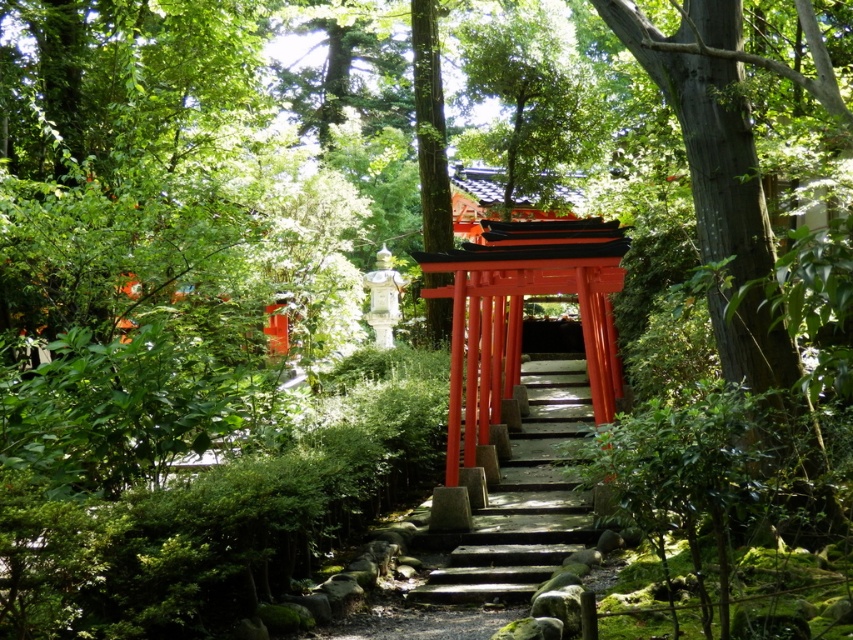
Question: Which of the following is the farthest from the observer?

Choices:
 (A) glossy stone stairs at center
 (B) smooth bark tree at right

Answer: (A)

Question: Is smooth bark tree at right to the left of glossy stone stairs at center from the viewer's perspective?

Choices:
 (A) no
 (B) yes

Answer: (A)

Question: Which of the following is the farthest from the observer?

Choices:
 (A) smooth bark tree at right
 (B) glossy stone stairs at center

Answer: (B)

Question: Does smooth bark tree at right have a greater width compared to glossy stone stairs at center?

Choices:
 (A) no
 (B) yes

Answer: (A)

Question: Does smooth bark tree at right have a lesser width compared to glossy stone stairs at center?

Choices:
 (A) yes
 (B) no

Answer: (A)